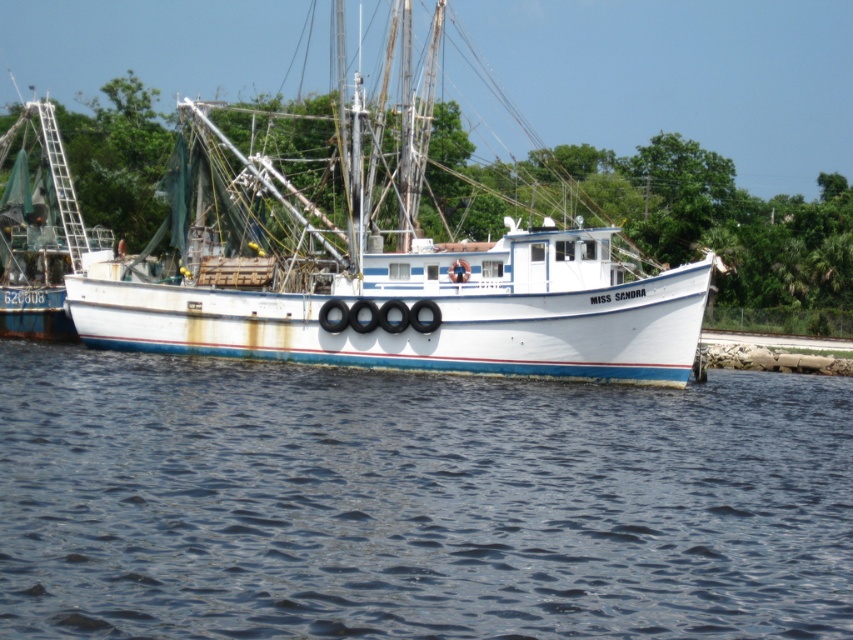
Question: Can you confirm if blue water at center is bigger than white matte boat at center?

Choices:
 (A) no
 (B) yes

Answer: (A)

Question: Can you confirm if blue water at center is bigger than white matte boat at center?

Choices:
 (A) no
 (B) yes

Answer: (A)

Question: Which point appears closest to the camera in this image?

Choices:
 (A) (300, 515)
 (B) (657, 330)

Answer: (A)

Question: Which point is closer to the camera taking this photo?

Choices:
 (A) (393, 259)
 (B) (750, 524)

Answer: (B)

Question: Is blue water at center below white matte boat at center?

Choices:
 (A) no
 (B) yes

Answer: (B)